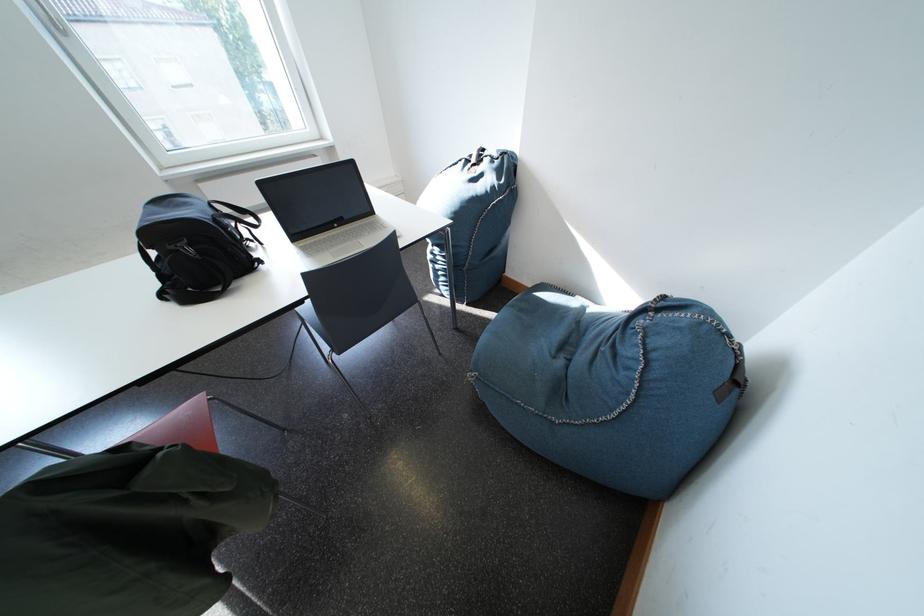
Find the location of `grey chair sitting surface`. grey chair sitting surface is located at coordinates (187, 430).